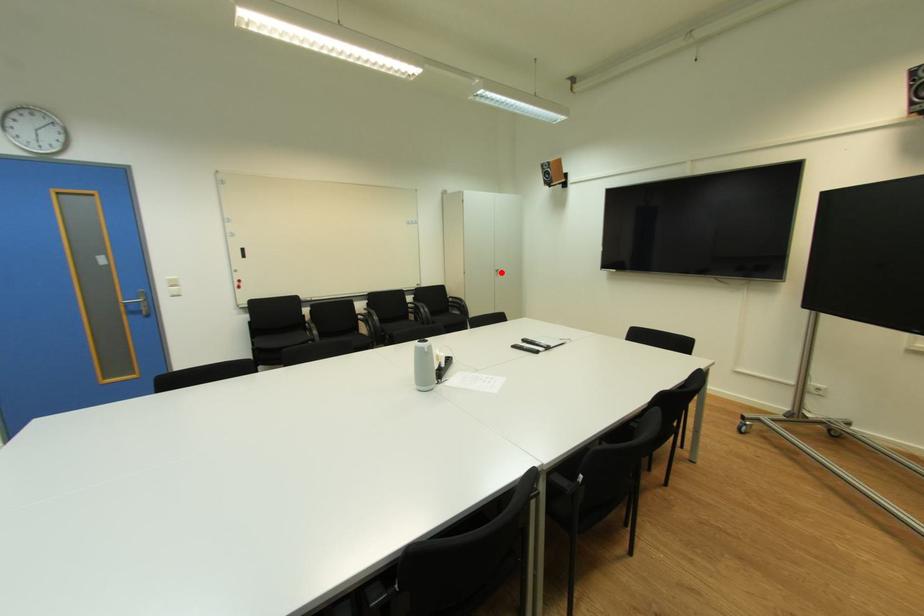
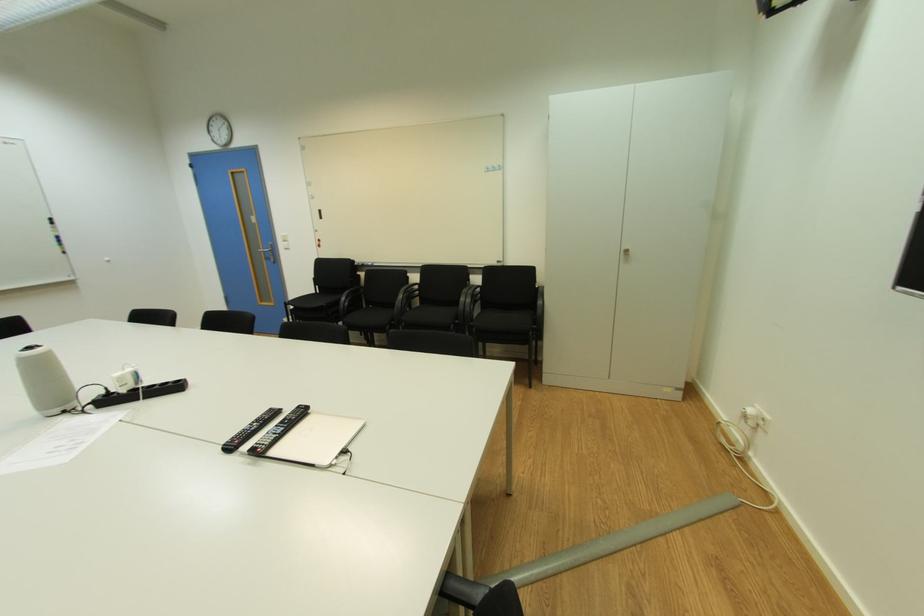
The point at the highlighted location is marked in the first image. Where is the corresponding point in the second image?

(628, 254)